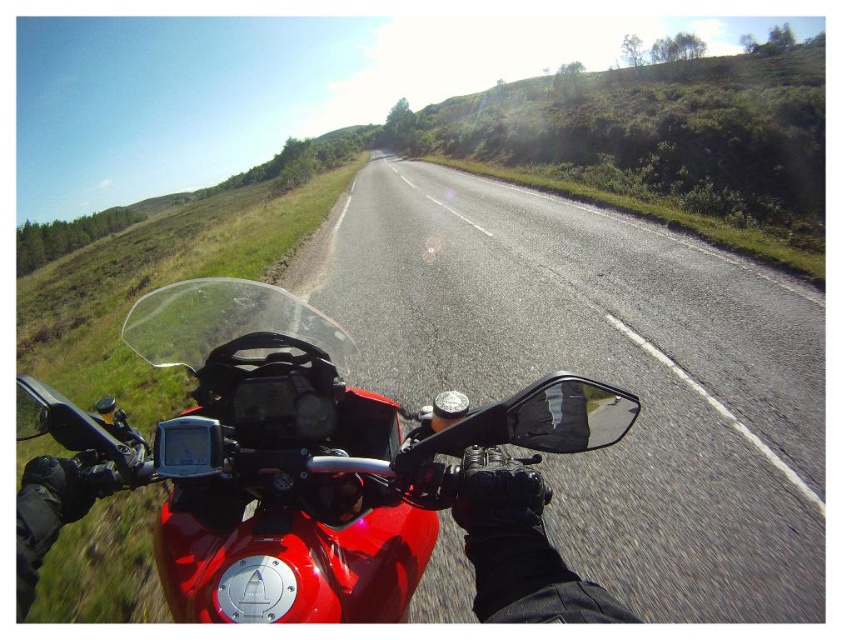
Question: Does asphalt road at center appear under glossy red motorcycle at center?

Choices:
 (A) yes
 (B) no

Answer: (B)

Question: Is asphalt road at center behind glossy red motorcycle at center?

Choices:
 (A) yes
 (B) no

Answer: (A)

Question: Among these points, which one is nearest to the camera?

Choices:
 (A) (440, 481)
 (B) (430, 588)

Answer: (A)

Question: Which object appears closest to the camera in this image?

Choices:
 (A) asphalt road at center
 (B) glossy red motorcycle at center

Answer: (B)

Question: Among these points, which one is nearest to the camera?

Choices:
 (A) (366, 605)
 (B) (775, 536)

Answer: (A)

Question: Can you confirm if asphalt road at center is thinner than glossy red motorcycle at center?

Choices:
 (A) no
 (B) yes

Answer: (A)